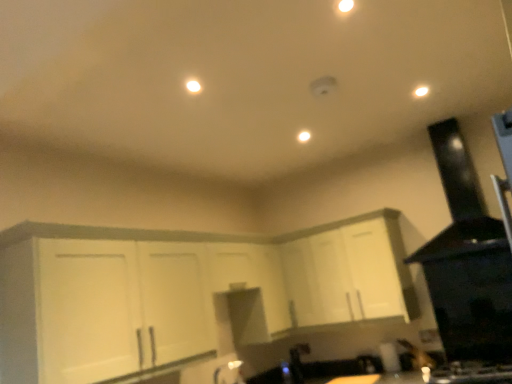
This screenshot has height=384, width=512. In order to click on black matte exhaust hood at upper right in this screenshot , I will do `click(460, 202)`.

Image resolution: width=512 pixels, height=384 pixels. What do you see at coordinates (304, 136) in the screenshot?
I see `matte white light at center, the first light from the back` at bounding box center [304, 136].

The width and height of the screenshot is (512, 384). What do you see at coordinates (188, 293) in the screenshot?
I see `white matte cabinet at center, acting as the first cabinetry starting from the left` at bounding box center [188, 293].

Image resolution: width=512 pixels, height=384 pixels. In order to click on white glossy light at upper right, which appears as the first light when viewed from the front in this screenshot , I will do `click(421, 91)`.

The height and width of the screenshot is (384, 512). Describe the element at coordinates (229, 373) in the screenshot. I see `white glossy faucet at lower center` at that location.

You are a GUI agent. You are given a task and a screenshot of the screen. Output one action in this format:
    pyautogui.click(x=<x>, y=<y>)
    Task: Click on the black matte exhaust hood at upper right
    This screenshot has height=384, width=512.
    Given the screenshot: What is the action you would take?
    pyautogui.click(x=460, y=202)

Does white glossy light at upper right, which appears as the first light when viewed from the front, have a lesser width compared to black matte exhaust hood at upper right?

Yes.

Is white glossy light at upper right, which is the 1th light from top to bottom, far from black matte exhaust hood at upper right?

No, white glossy light at upper right, which is the 1th light from top to bottom, is in close proximity to black matte exhaust hood at upper right.

Which is more to the right, white glossy light at upper right, which is the 1th light from top to bottom, or black matte exhaust hood at upper right?

black matte exhaust hood at upper right.

Does white glossy light at upper right, placed as the second light when sorted from back to front, have a lesser height compared to black matte exhaust hood at upper right?

Correct, white glossy light at upper right, placed as the second light when sorted from back to front, is not as tall as black matte exhaust hood at upper right.

Image resolution: width=512 pixels, height=384 pixels. I want to click on faucet on the right of white matte cabinet at center, acting as the first cabinetry starting from the left, so click(x=229, y=373).

Is white glossy faucet at lower center beside white matte cabinet at center, acting as the first cabinetry starting from the left?

No.

Could you tell me if white glossy faucet at lower center is turned towards white matte cabinet at center, acting as the first cabinetry starting from the left?

No, white glossy faucet at lower center is not oriented towards white matte cabinet at center, acting as the first cabinetry starting from the left.

Is point (231, 376) positioned before point (337, 293)?

No, (231, 376) is behind (337, 293).

Between white matte cabinet at center, which ranks as the 2th cabinetry in left-to-right order, and black matte exhaust hood at upper right, which one has less height?

white matte cabinet at center, which ranks as the 2th cabinetry in left-to-right order.

Considering the sizes of white matte cabinet at center, the first cabinetry viewed from the right, and black matte exhaust hood at upper right in the image, is white matte cabinet at center, the first cabinetry viewed from the right, wider or thinner than black matte exhaust hood at upper right?

In the image, white matte cabinet at center, the first cabinetry viewed from the right, appears to be more narrow than black matte exhaust hood at upper right.

From the image's perspective, who appears lower, white matte cabinet at center, which ranks as the 2th cabinetry in left-to-right order, or black matte exhaust hood at upper right?

white matte cabinet at center, which ranks as the 2th cabinetry in left-to-right order, is shown below in the image.

Is white matte cabinet at center, which ranks as the 2th cabinetry in left-to-right order, oriented away from black matte exhaust hood at upper right?

No, white matte cabinet at center, which ranks as the 2th cabinetry in left-to-right order,'s orientation is not away from black matte exhaust hood at upper right.

Considering the sizes of objects white glossy faucet at lower center and black matte exhaust hood at upper right in the image provided, who is bigger, white glossy faucet at lower center or black matte exhaust hood at upper right?

Bigger between the two is black matte exhaust hood at upper right.

Choose the correct answer: Is white glossy faucet at lower center inside black matte exhaust hood at upper right or outside it?

white glossy faucet at lower center cannot be found inside black matte exhaust hood at upper right.

Which object is closer to the camera taking this photo, white glossy faucet at lower center or black matte exhaust hood at upper right?

black matte exhaust hood at upper right is in front.

From the picture: Is white glossy faucet at lower center looking in the opposite direction of black matte exhaust hood at upper right?

No, white glossy faucet at lower center's orientation is not away from black matte exhaust hood at upper right.

Which is closer, (221, 374) or (387, 232)?

Positioned in front is point (387, 232).

Is white glossy faucet at lower center beside white matte cabinet at center, the first cabinetry viewed from the right?

No, white glossy faucet at lower center is not next to white matte cabinet at center, the first cabinetry viewed from the right.

Who is smaller, white glossy faucet at lower center or white matte cabinet at center, the first cabinetry viewed from the right?

white glossy faucet at lower center.

The image size is (512, 384). I want to click on gas stove that appears on the right of matte white light at center, the 1th light when ordered from left to right, so click(468, 373).

Considering the sizes of matte white light at center, acting as the second light starting from the right, and black glossy gas stove at lower right in the image, is matte white light at center, acting as the second light starting from the right, taller or shorter than black glossy gas stove at lower right?

Considering their sizes, matte white light at center, acting as the second light starting from the right, has less height than black glossy gas stove at lower right.

From the image's perspective, is matte white light at center, the first light from the back, above black glossy gas stove at lower right?

Indeed, from the image's perspective, matte white light at center, the first light from the back, is shown above black glossy gas stove at lower right.

In terms of width, does matte white light at center, the first light from the back, look wider or thinner when compared to black glossy gas stove at lower right?

Clearly, matte white light at center, the first light from the back, has less width compared to black glossy gas stove at lower right.

From the image's perspective, is black glossy gas stove at lower right above or below white glossy light at upper right, which is the 1th light from top to bottom?

black glossy gas stove at lower right is below white glossy light at upper right, which is the 1th light from top to bottom.

Could you tell me if black glossy gas stove at lower right is facing white glossy light at upper right, which ranks as the 1th light in right-to-left order?

No, black glossy gas stove at lower right is not turned towards white glossy light at upper right, which ranks as the 1th light in right-to-left order.

Considering the sizes of objects black glossy gas stove at lower right and white glossy light at upper right, placed as the second light when sorted from back to front, in the image provided, who is shorter, black glossy gas stove at lower right or white glossy light at upper right, placed as the second light when sorted from back to front,?

Standing shorter between the two is white glossy light at upper right, placed as the second light when sorted from back to front.

Between point (432, 382) and point (426, 93), which one is positioned behind?

The point (432, 382) is behind.

Where is `light that is the 1st object to the left of the black matte exhaust hood at upper right, starting at the anchor`? The image size is (512, 384). light that is the 1st object to the left of the black matte exhaust hood at upper right, starting at the anchor is located at coordinates (421, 91).

Where is `the 1st cabinetry positioned above the white glossy faucet at lower center (from the image's perspective)`? The image size is (512, 384). the 1st cabinetry positioned above the white glossy faucet at lower center (from the image's perspective) is located at coordinates point(188,293).

Estimate the real-world distances between objects in this image. Which object is closer to black matte exhaust hood at upper right, white matte cabinet at center, the first cabinetry viewed from the right, or matte white light at center, the first light from the back?

white matte cabinet at center, the first cabinetry viewed from the right, is positioned closer to the anchor black matte exhaust hood at upper right.

Estimate the real-world distances between objects in this image. Which object is further from matte white light at center, the 2th light in the front-to-back sequence, white glossy light at upper right, acting as the 2th light starting from the left, or white glossy faucet at lower center?

Based on the image, white glossy faucet at lower center appears to be further to matte white light at center, the 2th light in the front-to-back sequence.

Estimate the real-world distances between objects in this image. Which object is closer to black glossy gas stove at lower right, matte white light at center, the 2th light in the front-to-back sequence, or black matte exhaust hood at upper right?

black matte exhaust hood at upper right lies closer to black glossy gas stove at lower right than the other object.

Estimate the real-world distances between objects in this image. Which object is further from matte white light at center, the 2th light in the front-to-back sequence, white glossy faucet at lower center or white matte cabinet at center, acting as the first cabinetry starting from the left?

white glossy faucet at lower center.

From the picture: Which object lies nearer to the anchor point black glossy gas stove at lower right, white matte cabinet at center, which ranks as the 2th cabinetry in left-to-right order, or black matte exhaust hood at upper right?

white matte cabinet at center, which ranks as the 2th cabinetry in left-to-right order, is closer to black glossy gas stove at lower right.

Considering their positions, is white glossy faucet at lower center positioned further to white matte cabinet at center, the first cabinetry viewed from the right, than white matte cabinet at center, acting as the first cabinetry starting from the left?

The object further to white matte cabinet at center, the first cabinetry viewed from the right, is white glossy faucet at lower center.

Looking at this image, based on their spatial positions, is black matte exhaust hood at upper right or white glossy faucet at lower center closer to black glossy gas stove at lower right?

The object closer to black glossy gas stove at lower right is black matte exhaust hood at upper right.

Based on their spatial positions, is white glossy faucet at lower center or black glossy gas stove at lower right closer to white matte cabinet at center, the 2th cabinetry viewed from the right?

white glossy faucet at lower center is positioned closer to the anchor white matte cabinet at center, the 2th cabinetry viewed from the right.

This screenshot has width=512, height=384. What are the coordinates of `light between white glossy light at upper right, which ranks as the 1th light in right-to-left order, and white matte cabinet at center, the first cabinetry viewed from the right, from top to bottom` in the screenshot? It's located at click(304, 136).

Locate an element on the screen. light between white glossy light at upper right, marked as the second light in a bottom-to-top arrangement, and white glossy faucet at lower center, in the vertical direction is located at coordinates (304, 136).

The height and width of the screenshot is (384, 512). In order to click on exhaust hood between white glossy faucet at lower center and black glossy gas stove at lower right from left to right in this screenshot , I will do (460, 202).

This screenshot has width=512, height=384. Find the location of `exhaust hood between white matte cabinet at center, the 2th cabinetry viewed from the right, and black glossy gas stove at lower right`. exhaust hood between white matte cabinet at center, the 2th cabinetry viewed from the right, and black glossy gas stove at lower right is located at coordinates (460, 202).